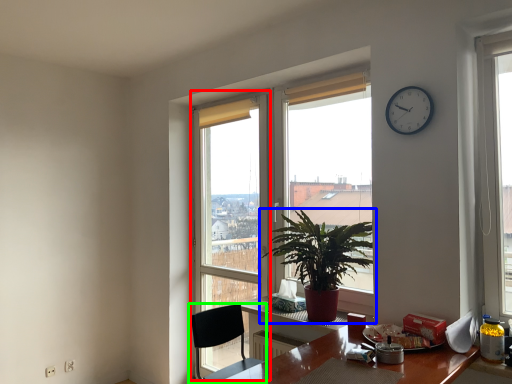
Question: Which is farther away from glass door (highlighted by a red box)? houseplant (highlighted by a blue box) or chair (highlighted by a green box)?

Choices:
 (A) houseplant
 (B) chair

Answer: (B)